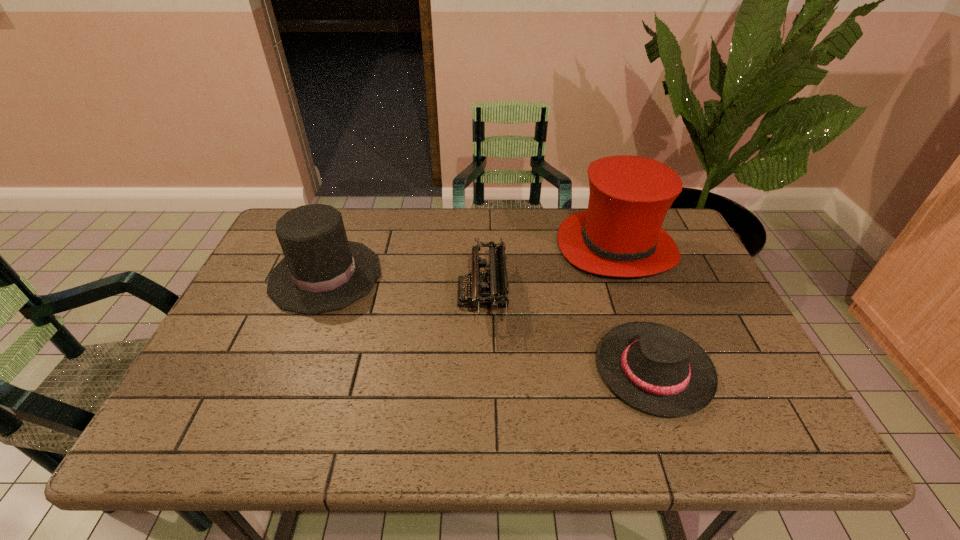
Locate an element on the screen. The height and width of the screenshot is (540, 960). vacant space situated on the back of the shortest dress hat is located at coordinates (615, 260).

Where is `object situated at the near edge`? object situated at the near edge is located at coordinates (657, 369).

I want to click on object present at the left edge, so click(x=322, y=271).

The width and height of the screenshot is (960, 540). I want to click on object located at the far left corner, so click(x=322, y=271).

Where is `object that is at the far right corner`? This screenshot has width=960, height=540. object that is at the far right corner is located at coordinates coord(620,235).

You are a GUI agent. You are given a task and a screenshot of the screen. Output one action in this format:
    pyautogui.click(x=<x>, y=<y>)
    Task: Click on the object that is positioned at the near right corner
    The width and height of the screenshot is (960, 540).
    Given the screenshot: What is the action you would take?
    pyautogui.click(x=657, y=369)

At what (x,y) coordinates should I click in order to perform the action: click on vacant space at the far edge. Please return your answer as a coordinate pair (x, y). Image resolution: width=960 pixels, height=540 pixels. Looking at the image, I should click on (416, 225).

This screenshot has height=540, width=960. What are the coordinates of `vacant space at the near edge of the desktop` in the screenshot? It's located at (426, 444).

I want to click on vacant space at the left edge, so click(x=251, y=310).

The image size is (960, 540). In order to click on vacant space at the right edge in this screenshot , I will do `click(658, 288)`.